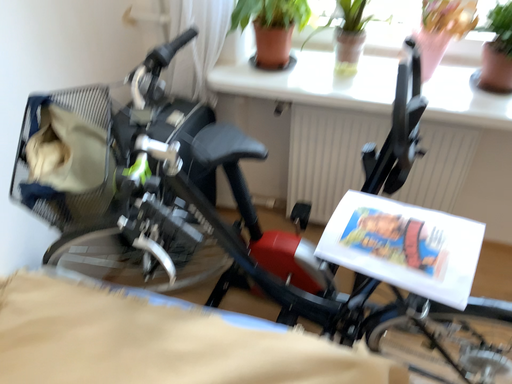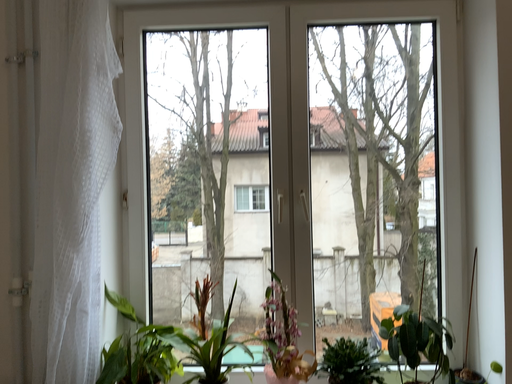
Question: How did the camera likely rotate when shooting the video?

Choices:
 (A) rotated left
 (B) rotated right

Answer: (B)